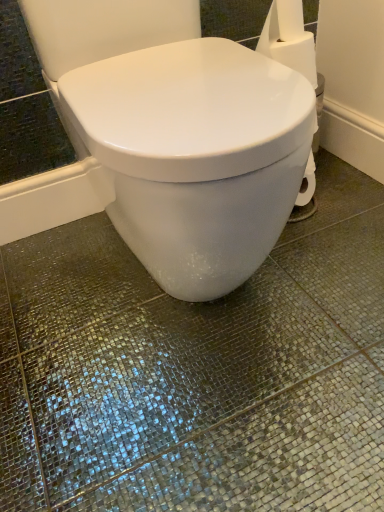
Question: Looking at the image, does white paper at upper right seem bigger or smaller compared to white glossy toilet at center?

Choices:
 (A) small
 (B) big

Answer: (A)

Question: From the image's perspective, is white paper at upper right above or below white glossy toilet at center?

Choices:
 (A) below
 (B) above

Answer: (B)

Question: Is white paper at upper right in front of or behind white glossy toilet at center in the image?

Choices:
 (A) behind
 (B) front

Answer: (A)

Question: Do you think white glossy toilet at center is within white paper at upper right, or outside of it?

Choices:
 (A) outside
 (B) inside

Answer: (A)

Question: Based on their sizes in the image, would you say white glossy toilet at center is bigger or smaller than white paper at upper right?

Choices:
 (A) small
 (B) big

Answer: (B)

Question: In terms of width, does white glossy toilet at center look wider or thinner when compared to white paper at upper right?

Choices:
 (A) thin
 (B) wide

Answer: (B)

Question: In the image, is white glossy toilet at center positioned in front of or behind white paper at upper right?

Choices:
 (A) front
 (B) behind

Answer: (A)